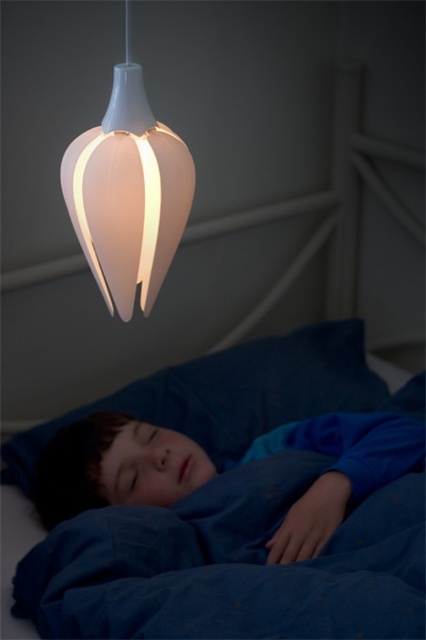
You are a parent checking on your child. You notice the blue fabric pillow at lower center and the white matte lampshade at upper center. Which object is taller?

The blue fabric pillow at lower center is much taller than the white matte lampshade at upper center.

You are a photographer taking a picture of the child sleeping. You notice two points in the scene at coordinates point (319, 531) and point (357, 412). Which point will appear larger in your photo?

Point (319, 531) is closer to the camera than point (357, 412), so it will appear larger in the photo.

You are a parent checking on your child in the room. You notice two points of light in the dark room. The first point is at coordinates point (x=181, y=477) and the second is at point (x=144, y=109). Which point is closer to the child sleeping in bed?

Point (x=144, y=109) is closer to the child sleeping in bed because it is in front of point (x=181, y=477).